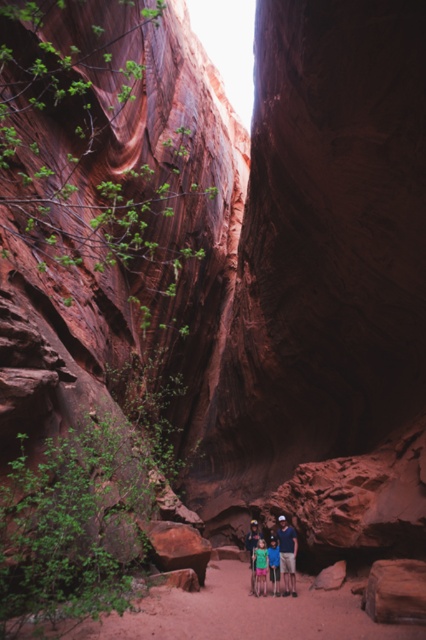
You are planning to take a photo of the matte red family at center and the light blue denim shorts at center in the slot canyon. Considering the width of these two objects, which one should be placed closer to the camera to maintain clarity in the photo?

The matte red family at center is wider than the light blue denim shorts at center. To maintain clarity, the wider matte red family at center should be placed closer to the camera since larger objects can be positioned nearer without losing detail.

You are hiking through the narrow slot canyon and see the matte red family at center and the light blue denim shorts at center. Which object is positioned more to the right side of the scene?

The matte red family at center is positioned to the right of the light blue denim shorts at center, so the matte red family at center is more to the right side of the scene.

You are hiking through the narrow slot canyon and notice two items of clothing worn by a group of people at the center. The items are the green matte shirt at center and the light blue denim shorts at center. Which clothing item is located to the left when viewed from your perspective?

The green matte shirt at center is positioned on the left side of the light blue denim shorts at center, so the green matte shirt at center is located to the left.